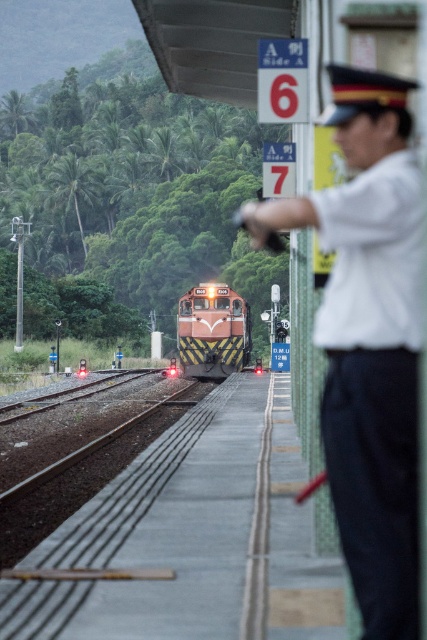
Question: Does white uniform at right have a lesser width compared to matte orange train at center?

Choices:
 (A) no
 (B) yes

Answer: (B)

Question: Is white uniform at right below matte orange train at center?

Choices:
 (A) no
 (B) yes

Answer: (A)

Question: Which of the following is the farthest from the observer?

Choices:
 (A) matte orange train at center
 (B) white uniform at right

Answer: (A)

Question: Which point appears farthest from the camera in this image?

Choices:
 (A) (219, 339)
 (B) (336, 445)

Answer: (A)

Question: Does white uniform at right appear on the left side of matte orange train at center?

Choices:
 (A) no
 (B) yes

Answer: (A)